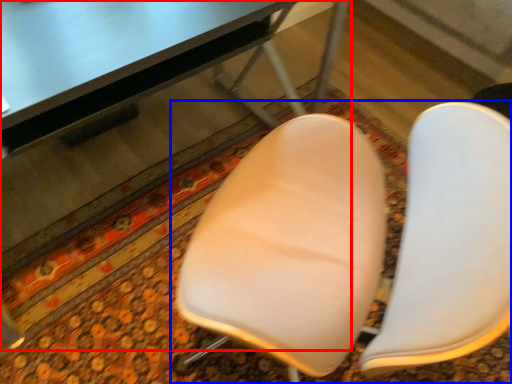
Question: Which object is further to the camera taking this photo, table (highlighted by a red box) or chair (highlighted by a blue box)?

Choices:
 (A) table
 (B) chair

Answer: (B)